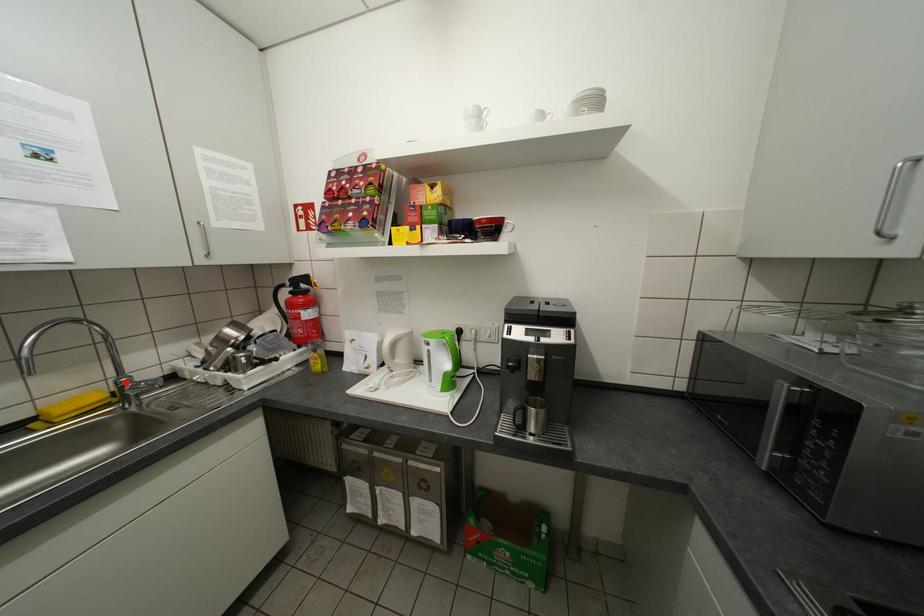
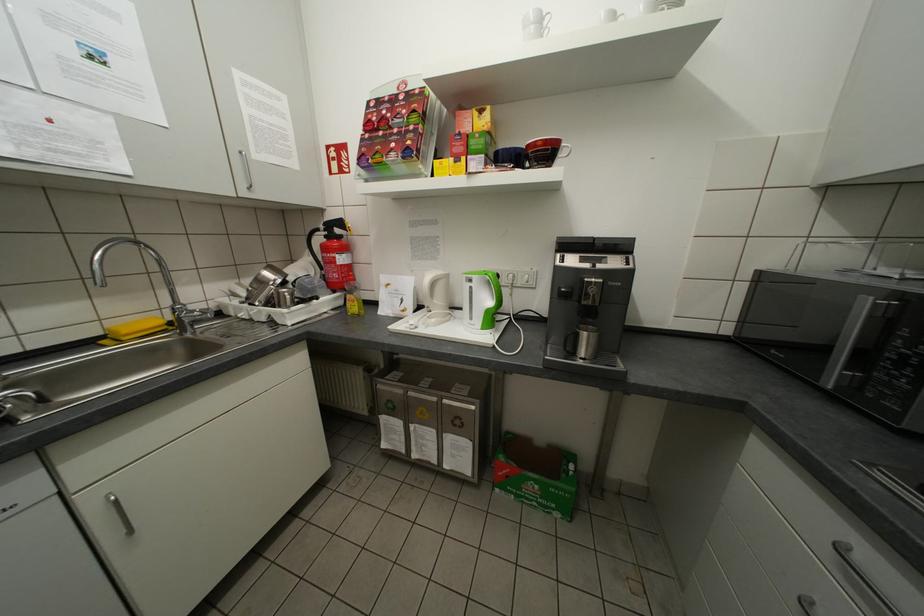
Locate, in the second image, the point that corresponds to the highlighted location in the first image.

(181, 309)